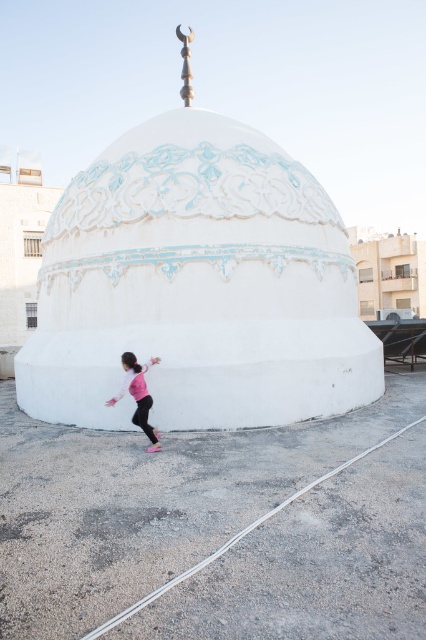
You are a photographer standing at the base of the white glossy dome at center and want to take a picture of the pink fabric child at lower left. Which direction should you move to get the child into the frame?

The white glossy dome at center is positioned over the pink fabric child at lower left, so you should move away from the dome towards the lower left to get the child into the frame.